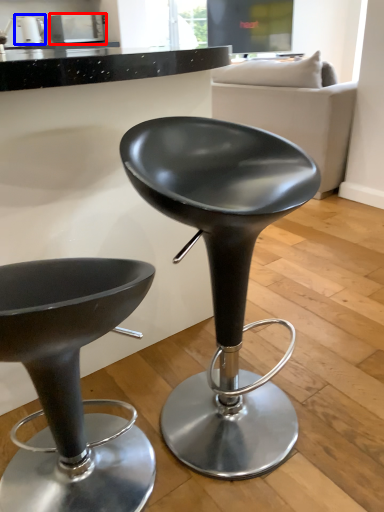
Question: Which of the following is the farthest to the observer, appliance (highlighted by a red box) or appliance (highlighted by a blue box)?

Choices:
 (A) appliance
 (B) appliance

Answer: (A)